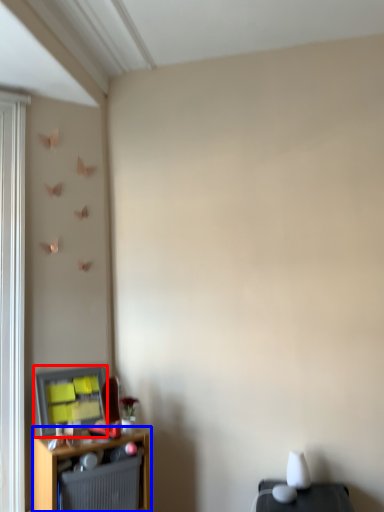
Question: Which of the following is the closest to the observer, window screen (highlighted by a red box) or shelf (highlighted by a blue box)?

Choices:
 (A) window screen
 (B) shelf

Answer: (B)